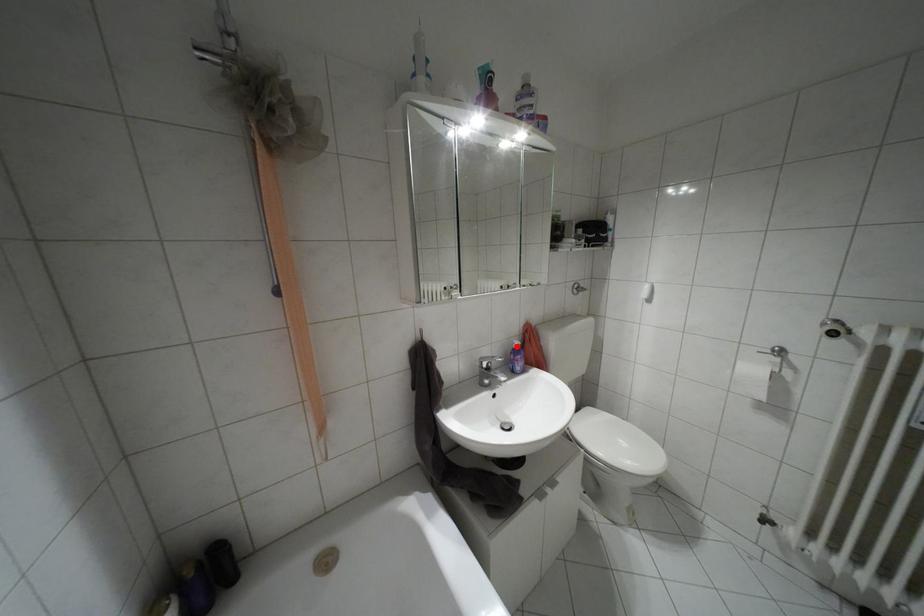
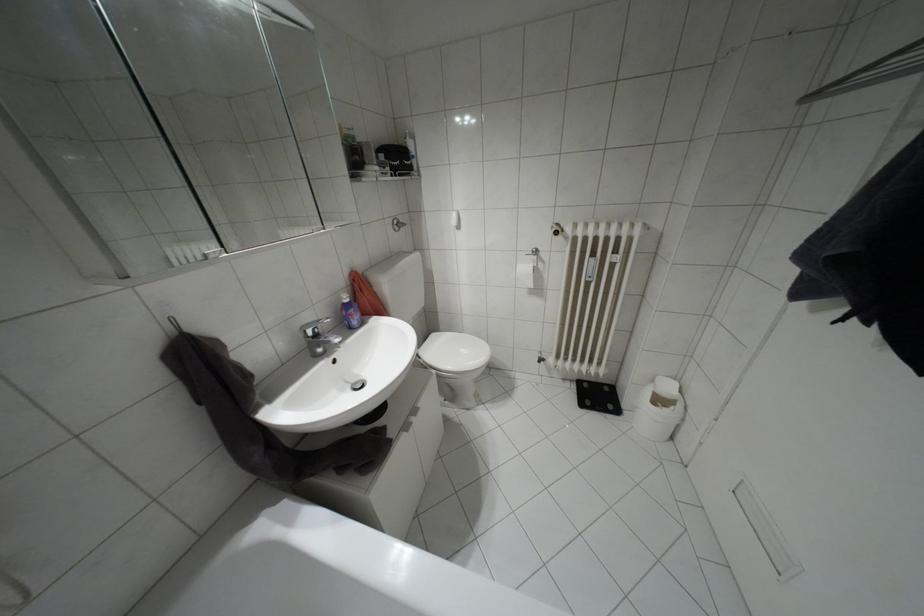
Find the pixel in the second image that matches the highlighted location in the first image.

(346, 300)